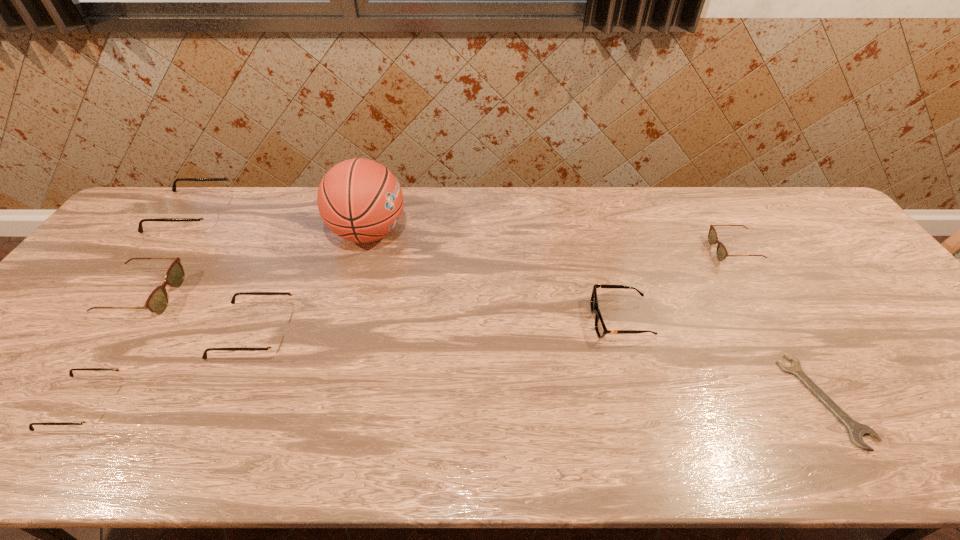
At what (x,y) coordinates should I click in order to perform the action: click on orange basketball. Please return your answer as a coordinate pair (x, y). The width and height of the screenshot is (960, 540). Looking at the image, I should click on (360, 200).

Identify the location of the fifth object from left to right. (360, 200).

Locate an element on the screen. The image size is (960, 540). the biggest black spectacles is located at coordinates (210, 218).

I want to click on the bigger brown spectacles, so click(157, 302).

At what (x,y) coordinates should I click in order to perform the action: click on the nearer brown spectacles. Please return your answer as a coordinate pair (x, y). This screenshot has height=540, width=960. Looking at the image, I should click on tap(157, 302).

This screenshot has height=540, width=960. I want to click on the second spectacles from right to left, so click(276, 343).

What are the coordinates of `the fifth object from right to left` in the screenshot? It's located at (276, 343).

Identify the location of the third object from right to left. The width and height of the screenshot is (960, 540). (600, 327).

Find the location of `black sunglasses`. black sunglasses is located at coordinates (600, 327).

Image resolution: width=960 pixels, height=540 pixels. I want to click on the rightmost spectacles, so click(x=722, y=253).